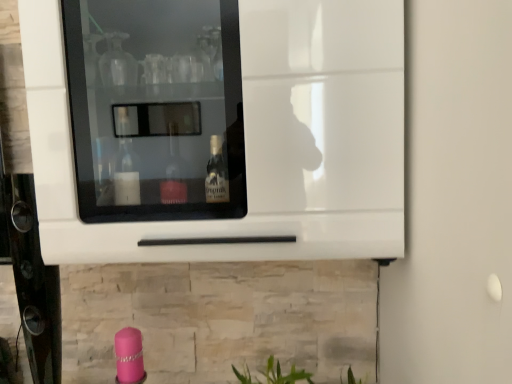
Locate an element on the screen. The height and width of the screenshot is (384, 512). white glossy refrigerator at center is located at coordinates point(216,129).

Image resolution: width=512 pixels, height=384 pixels. Describe the element at coordinates (216, 129) in the screenshot. I see `white glossy refrigerator at center` at that location.

You are a GUI agent. You are given a task and a screenshot of the screen. Output one action in this format:
    pyautogui.click(x=<x>, y=<y>)
    Task: Click on the white glossy refrigerator at center
    The height and width of the screenshot is (384, 512).
    Given the screenshot: What is the action you would take?
    pyautogui.click(x=216, y=129)